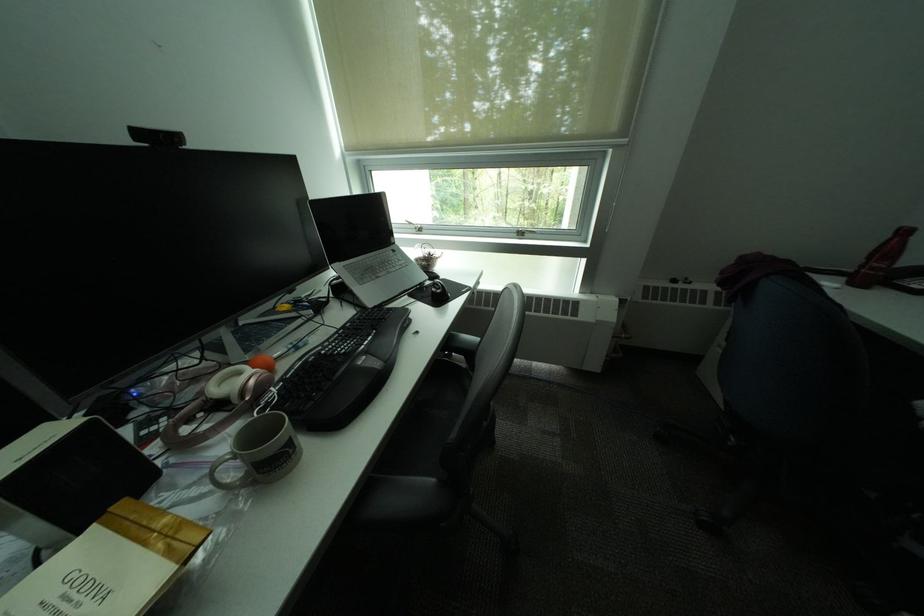
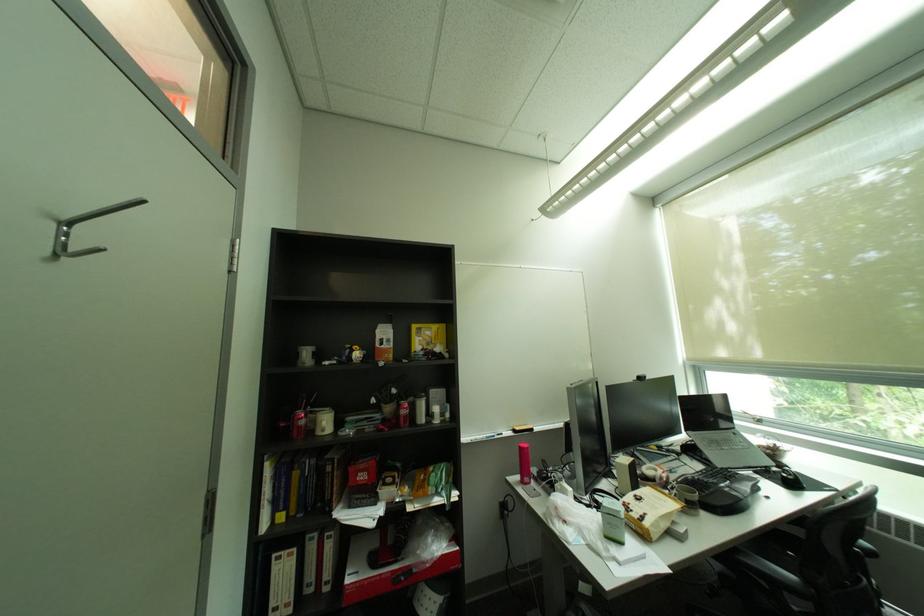
Find the pixel in the second image that matches point 432,285 in the first image.

(777, 468)